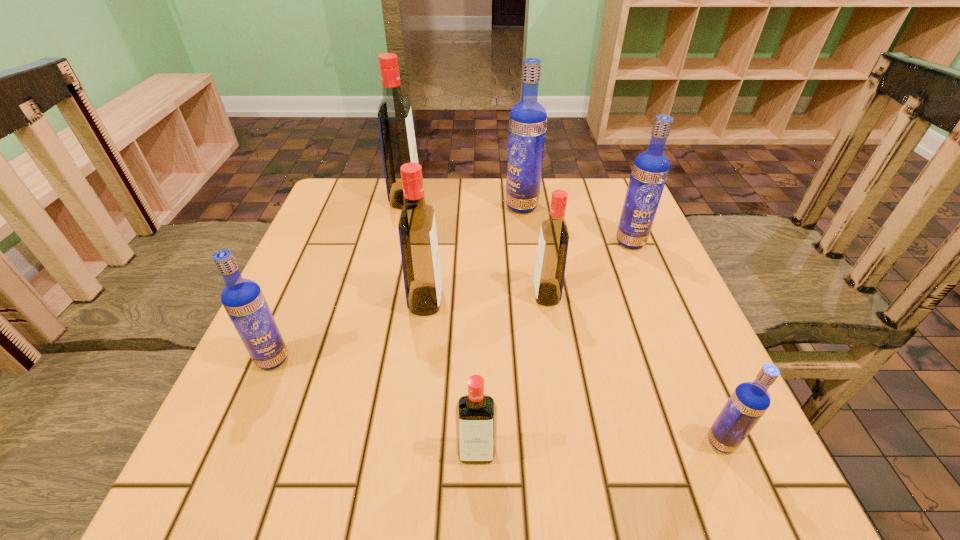
Image resolution: width=960 pixels, height=540 pixels. Identify the location of the second smallest red vodka. (551, 258).

Where is `the nearest blue vodka`? the nearest blue vodka is located at coordinates (749, 401).

The image size is (960, 540). What are the coordinates of `the fifth vodka from right to left` in the screenshot? It's located at (475, 413).

At what (x,y) coordinates should I click in order to perform the action: click on the fourth object from left to right. Please return your answer as a coordinate pair (x, y). Looking at the image, I should click on (475, 413).

Identify the location of vacant point located on the front and back of the farthest red vodka. (521, 199).

Where is `vacant space located 0.100m on the back of the farthest blue vodka`? vacant space located 0.100m on the back of the farthest blue vodka is located at coordinates (518, 179).

Where is `free spot located on the left of the third smallest blue vodka`? Image resolution: width=960 pixels, height=540 pixels. free spot located on the left of the third smallest blue vodka is located at coordinates (475, 242).

Locate an element on the screen. vacant space situated on the front and back of the third vodka from left to right is located at coordinates (570, 301).

You are a GUI agent. You are given a task and a screenshot of the screen. Output one action in this format:
    pyautogui.click(x=<x>, y=<y>)
    Task: Click on the free space located 0.260m on the back of the sixth farthest vodka
    The image size is (960, 540).
    Given the screenshot: What is the action you would take?
    pyautogui.click(x=317, y=256)

Where is `vacant space located 0.080m on the front and back of the rightmost red vodka`? The height and width of the screenshot is (540, 960). vacant space located 0.080m on the front and back of the rightmost red vodka is located at coordinates (495, 294).